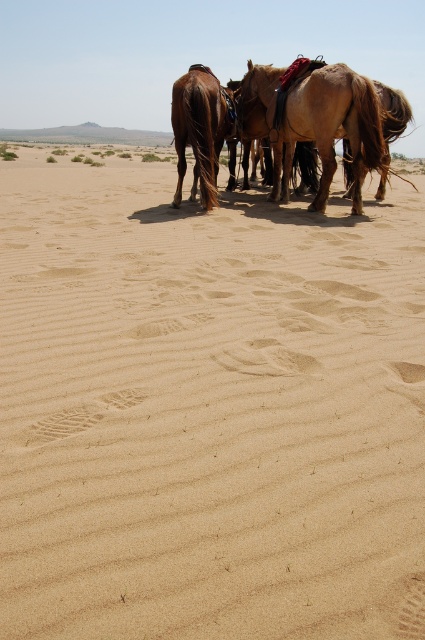
From the picture: Can you confirm if brown textured horse at center is positioned to the left of brown glossy horse at center?

Incorrect, brown textured horse at center is not on the left side of brown glossy horse at center.

Can you confirm if brown textured horse at center is wider than brown glossy horse at center?

Yes, brown textured horse at center is wider than brown glossy horse at center.

Between point (275, 141) and point (178, 144), which one is positioned behind?

The point (275, 141) is behind.

Locate an element on the screen. brown textured horse at center is located at coordinates (319, 122).